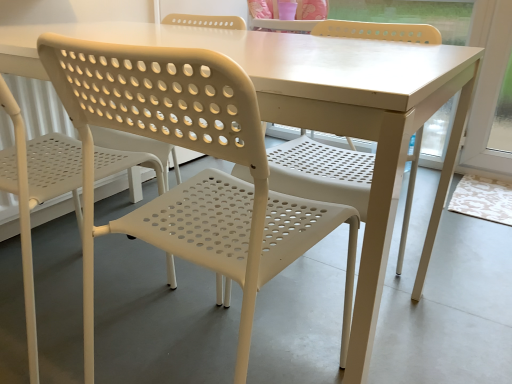
Question: Is white plastic chair at left, the 2th chair when ordered from right to left, next to white plastic chair at center, which appears as the first chair when viewed from the right, and touching it?

Choices:
 (A) yes
 (B) no

Answer: (B)

Question: Is white plastic chair at left, the 2th chair when ordered from right to left, bigger than white plastic chair at center, which appears as the first chair when viewed from the right?

Choices:
 (A) yes
 (B) no

Answer: (A)

Question: From the image's perspective, would you say white plastic chair at left, the 1th chair in the left-to-right sequence, is shown under white plastic chair at center, the second chair in the left-to-right sequence?

Choices:
 (A) yes
 (B) no

Answer: (B)

Question: Does white plastic chair at left, the 1th chair in the left-to-right sequence, appear on the left side of white plastic chair at center, which appears as the first chair when viewed from the right?

Choices:
 (A) yes
 (B) no

Answer: (A)

Question: Is white plastic chair at left, the 1th chair in the left-to-right sequence, facing towards white plastic chair at center, the second chair in the left-to-right sequence?

Choices:
 (A) no
 (B) yes

Answer: (A)

Question: Is white plastic chair at left, the 2th chair when ordered from right to left, not inside white plastic chair at center, the second chair in the left-to-right sequence?

Choices:
 (A) yes
 (B) no

Answer: (A)

Question: From a real-world perspective, is white plastic chair at center, which appears as the first chair when viewed from the right, below white plastic chair at left, the 1th chair in the left-to-right sequence?

Choices:
 (A) yes
 (B) no

Answer: (B)

Question: Is white plastic chair at center, the second chair in the left-to-right sequence, oriented towards white plastic chair at left, the 1th chair in the left-to-right sequence?

Choices:
 (A) yes
 (B) no

Answer: (B)

Question: Is white plastic chair at left, the 1th chair in the left-to-right sequence, inside white plastic chair at center, the second chair in the left-to-right sequence?

Choices:
 (A) yes
 (B) no

Answer: (B)

Question: From the image's perspective, is white plastic chair at center, the second chair in the left-to-right sequence, on top of white plastic chair at left, the 2th chair when ordered from right to left?

Choices:
 (A) no
 (B) yes

Answer: (A)

Question: Does white plastic chair at center, which appears as the first chair when viewed from the right, have a greater height compared to white plastic chair at left, the 2th chair when ordered from right to left?

Choices:
 (A) yes
 (B) no

Answer: (B)

Question: Are white plastic chair at center, which appears as the first chair when viewed from the right, and white plastic chair at left, the 1th chair in the left-to-right sequence, located far from each other?

Choices:
 (A) no
 (B) yes

Answer: (A)

Question: Is white plastic chair at left, the 2th chair when ordered from right to left, wider or thinner than white plastic chair at center, the second chair in the left-to-right sequence?

Choices:
 (A) thin
 (B) wide

Answer: (B)